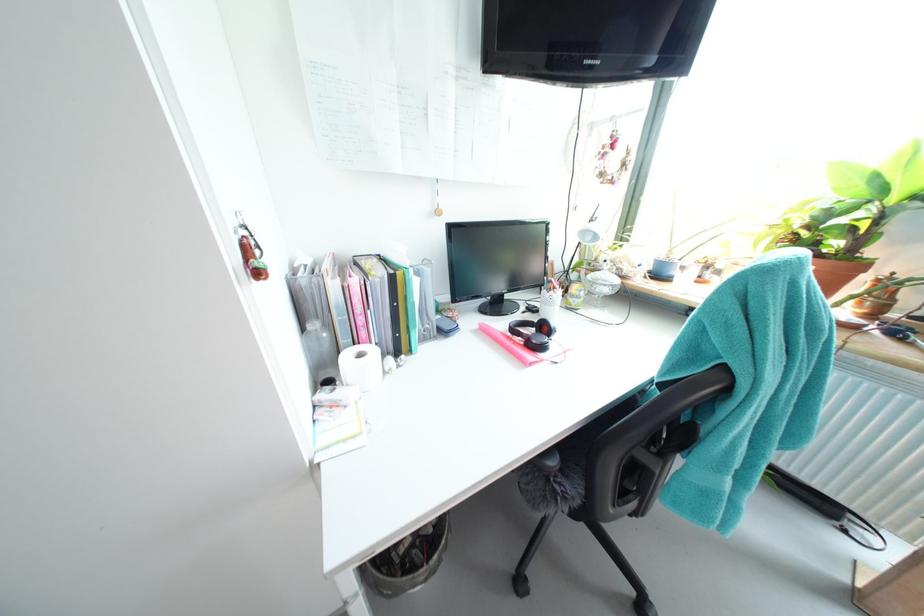
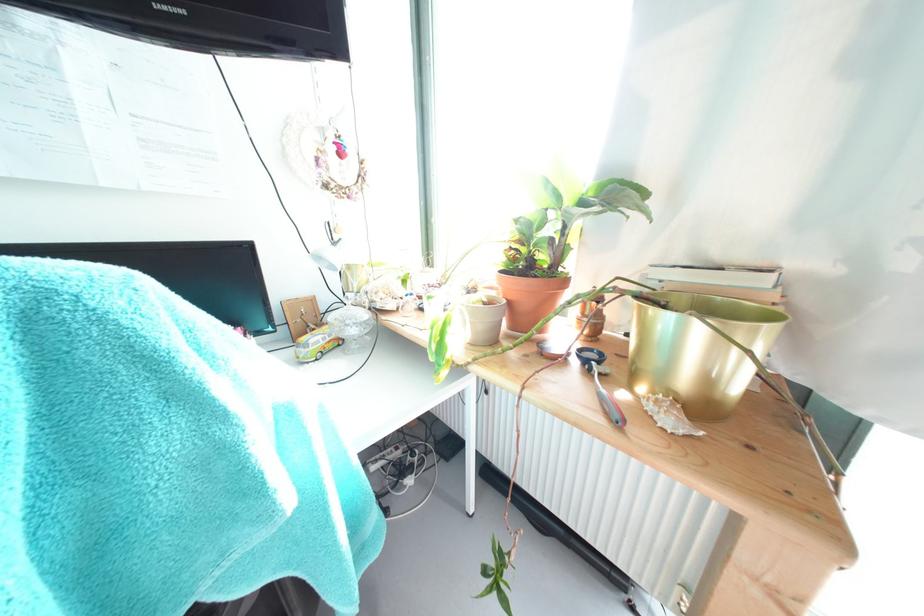
Question: The camera is either moving clockwise (left) or counter-clockwise (right) around the object. The first image is from the beginning of the video and the second image is from the end. Is the camera moving left or right when shooting the video?

Choices:
 (A) Left
 (B) Right

Answer: (A)